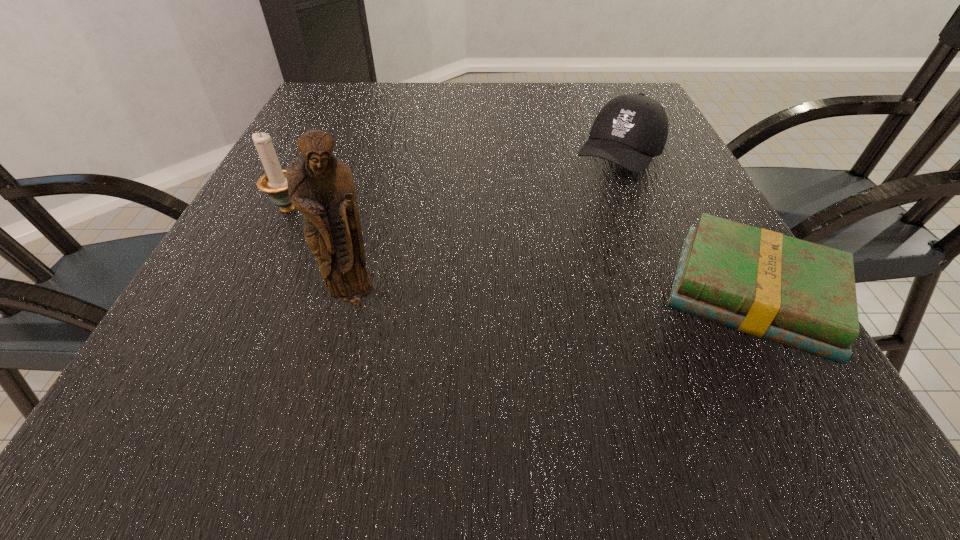
Where is `vacant space on the desktop that is between the tallest object and the book and is positioned on the handle side of the leftmost object`? This screenshot has width=960, height=540. vacant space on the desktop that is between the tallest object and the book and is positioned on the handle side of the leftmost object is located at coordinates (501, 298).

Locate an element on the screen. free space on the desktop that is between the figurine and the shortest object and is positioned on the front-facing side of the farthest object is located at coordinates (512, 297).